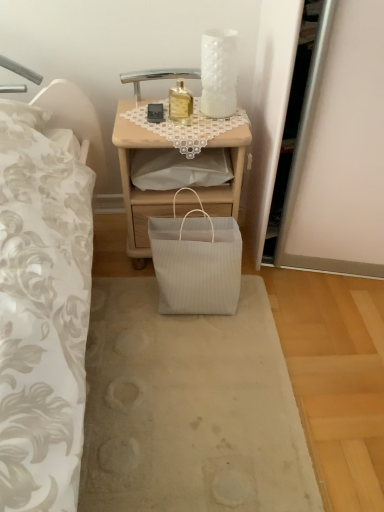
The width and height of the screenshot is (384, 512). What do you see at coordinates (196, 262) in the screenshot?
I see `white ribbed paper bag at lower center` at bounding box center [196, 262].

Where is `woodennightstand at center`? woodennightstand at center is located at coordinates (137, 188).

In order to face gold glass bottle at upper center, should I rotate leftwards or rightwards?

Rotate left and turn 1.202 degrees.

The width and height of the screenshot is (384, 512). Find the location of `white ribbed paper bag at lower center`. white ribbed paper bag at lower center is located at coordinates (196, 262).

Can you confirm if woodennightstand at center is shorter than gold glass bottle at upper center?

No, woodennightstand at center is not shorter than gold glass bottle at upper center.

From the picture: Can you see woodennightstand at center touching gold glass bottle at upper center?

No, woodennightstand at center is not making contact with gold glass bottle at upper center.

Does point (241, 126) appear closer or farther from the camera than point (179, 105)?

Point (241, 126).

In the scene shown: Does white ribbed paper bag at lower center turn towards gold glass bottle at upper center?

No, white ribbed paper bag at lower center is not turned towards gold glass bottle at upper center.

From a real-world perspective, is white ribbed paper bag at lower center located higher than gold glass bottle at upper center?

Actually, white ribbed paper bag at lower center is physically below gold glass bottle at upper center in the real world.

This screenshot has width=384, height=512. Identify the location of bag located on the right of gold glass bottle at upper center. tap(196, 262).

Is white ribbed paper bag at lower center thinner than gold glass bottle at upper center?

No, white ribbed paper bag at lower center is not thinner than gold glass bottle at upper center.

Which of these two, white ribbed paper bag at center or woodennightstand at center, stands shorter?

Standing shorter between the two is white ribbed paper bag at center.

Is woodennightstand at center surrounded by white ribbed paper bag at center?

No, woodennightstand at center is not a part of white ribbed paper bag at center.

You are a GUI agent. You are given a task and a screenshot of the screen. Output one action in this format:
    pyautogui.click(x=<x>, y=<y>)
    Task: Click on the plain below the woodennightstand at center (from the image's perspective)
    The image size is (384, 512).
    Given the screenshot: What is the action you would take?
    pyautogui.click(x=189, y=408)

Is gold glass bottle at upper center not near woodennightstand at center?

gold glass bottle at upper center is actually quite close to woodennightstand at center.

Considering the positions of objects gold glass bottle at upper center and woodennightstand at center in the image provided, who is more to the right, gold glass bottle at upper center or woodennightstand at center?

Positioned to the right is gold glass bottle at upper center.

From a real-world perspective, is gold glass bottle at upper center positioned over woodennightstand at center based on gravity?

Indeed, from a real-world perspective, gold glass bottle at upper center stands above woodennightstand at center.

Can you confirm if white ribbed paper bag at lower center is taller than woodennightstand at center?

No, white ribbed paper bag at lower center is not taller than woodennightstand at center.

Can you tell me how much white ribbed paper bag at lower center and woodennightstand at center differ in facing direction?

There is a 1.5-degree angle between the facing directions of white ribbed paper bag at lower center and woodennightstand at center.

From a real-world perspective, which is physically below, white ribbed paper bag at lower center or woodennightstand at center?

In real-world perspective, white ribbed paper bag at lower center is lower.

In order to click on bag lying below the woodennightstand at center (from the image's perspective) in this screenshot , I will do `click(196, 262)`.

Considering the positions of objects woodennightstand at center and white ribbed paper bag at center in the image provided, who is in front, woodennightstand at center or white ribbed paper bag at center?

white ribbed paper bag at center is closer to the camera.

Is point (114, 142) closer or farther from the camera than point (166, 459)?

Clearly, point (114, 142) is more distant from the camera than point (166, 459).

Would you say woodennightstand at center is inside or outside white ribbed paper bag at center?

woodennightstand at center cannot be found inside white ribbed paper bag at center.

Is woodennightstand at center at the left side of white ribbed paper bag at center?

Yes.

Which is closer, (175, 104) or (208, 265)?

Point (175, 104).

Is white ribbed paper bag at lower center located within gold glass bottle at upper center?

No, white ribbed paper bag at lower center is not a part of gold glass bottle at upper center.

Who is taller, gold glass bottle at upper center or white ribbed paper bag at lower center?

white ribbed paper bag at lower center is taller.

Does gold glass bottle at upper center lie in front of white ribbed paper bag at lower center?

No, it is not.

This screenshot has height=512, width=384. Find the location of `bottle on the right of the woodennightstand at center`. bottle on the right of the woodennightstand at center is located at coordinates (180, 104).

The height and width of the screenshot is (512, 384). Find the location of `bag below the gold glass bottle at upper center (from a real-world perspective)`. bag below the gold glass bottle at upper center (from a real-world perspective) is located at coordinates (196, 262).

Based on their spatial positions, is gold glass bottle at upper center or woodennightstand at center closer to white ribbed paper bag at center?

woodennightstand at center lies closer to white ribbed paper bag at center than the other object.

From the image, which object appears to be nearer to gold glass bottle at upper center, white ribbed paper bag at lower center or white ribbed paper bag at center?

white ribbed paper bag at lower center.

Based on their spatial positions, is white ribbed paper bag at lower center or gold glass bottle at upper center closer to woodennightstand at center?

white ribbed paper bag at lower center lies closer to woodennightstand at center than the other object.

Based on the photo, which object lies nearer to the anchor point woodennightstand at center, white ribbed paper bag at lower center or white ribbed paper bag at center?

Based on the image, white ribbed paper bag at lower center appears to be nearer to woodennightstand at center.

Which object lies further to the anchor point white ribbed paper bag at lower center, gold glass bottle at upper center or white ribbed paper bag at center?

gold glass bottle at upper center.

Looking at the image, which one is located further to white ribbed paper bag at center, woodennightstand at center or white ribbed paper bag at lower center?

woodennightstand at center is positioned further to the anchor white ribbed paper bag at center.

Which object lies nearer to the anchor point gold glass bottle at upper center, woodennightstand at center or white ribbed paper bag at center?

Based on the image, woodennightstand at center appears to be nearer to gold glass bottle at upper center.

Looking at the image, which one is located closer to woodennightstand at center, gold glass bottle at upper center or white ribbed paper bag at center?

gold glass bottle at upper center.

Image resolution: width=384 pixels, height=512 pixels. Find the location of `bag between gold glass bottle at upper center and white ribbed paper bag at center vertically`. bag between gold glass bottle at upper center and white ribbed paper bag at center vertically is located at coordinates (196, 262).

You are a GUI agent. You are given a task and a screenshot of the screen. Output one action in this format:
    pyautogui.click(x=<x>, y=<y>)
    Task: Click on the nightstand that lies between gold glass bottle at upper center and white ribbed paper bag at lower center from top to bottom
    The height and width of the screenshot is (512, 384).
    Given the screenshot: What is the action you would take?
    pyautogui.click(x=137, y=188)

Identify the location of nightstand between gold glass bottle at upper center and white ribbed paper bag at center in the up-down direction. (137, 188).

The height and width of the screenshot is (512, 384). Identify the location of bag between woodennightstand at center and white ribbed paper bag at center in the vertical direction. (196, 262).